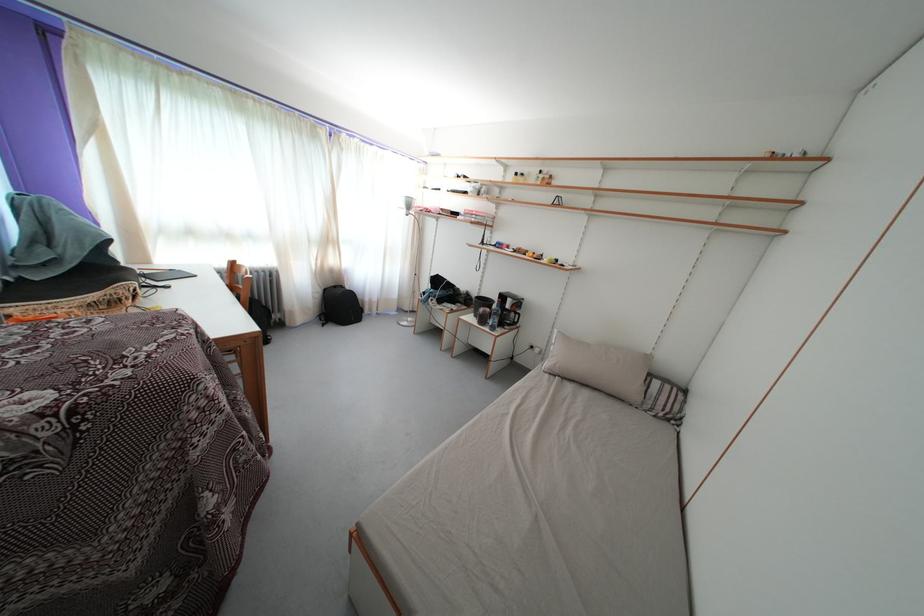
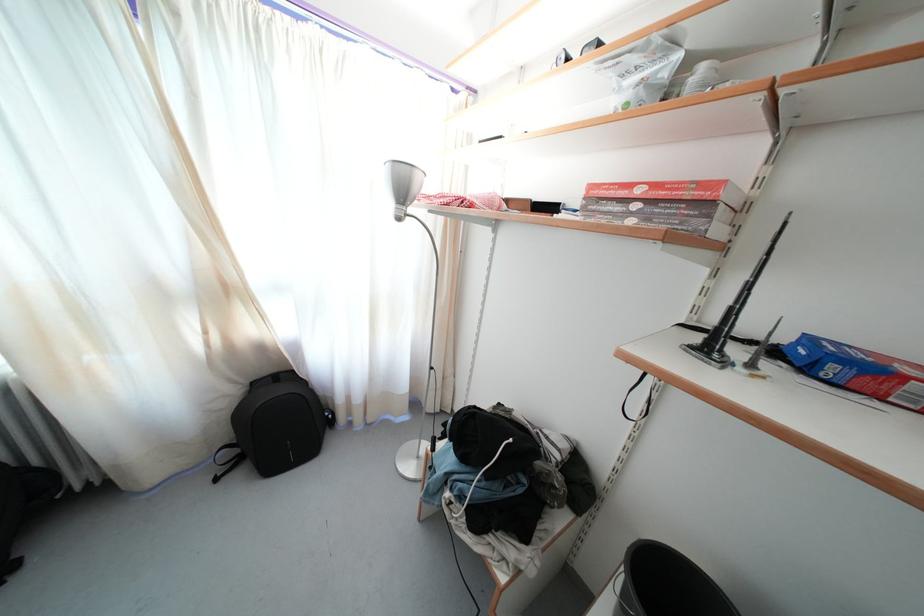
The point at [415,213] is marked in the first image. Where is the corresponding point in the second image?

(408, 199)